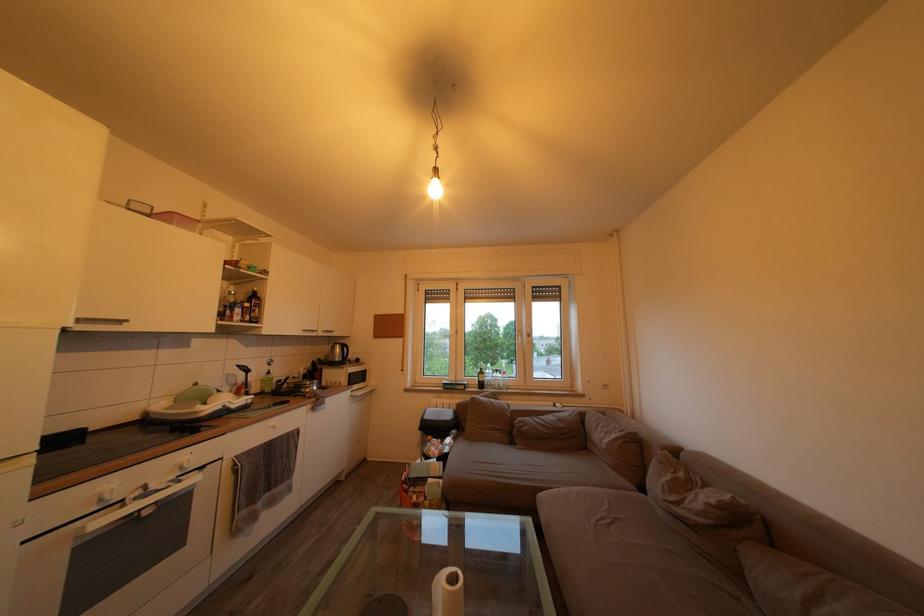
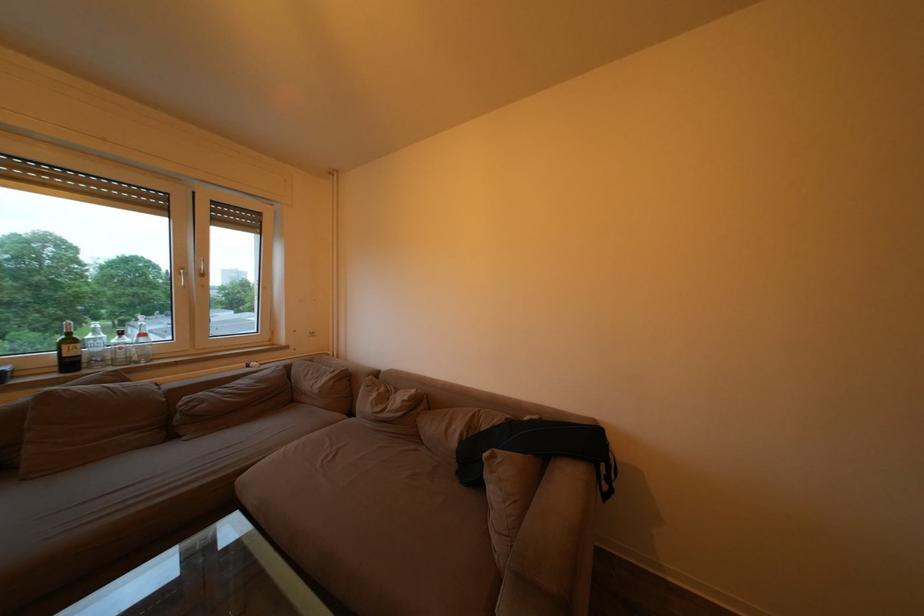
The point at (520, 448) is marked in the first image. Where is the corresponding point in the second image?

(178, 443)